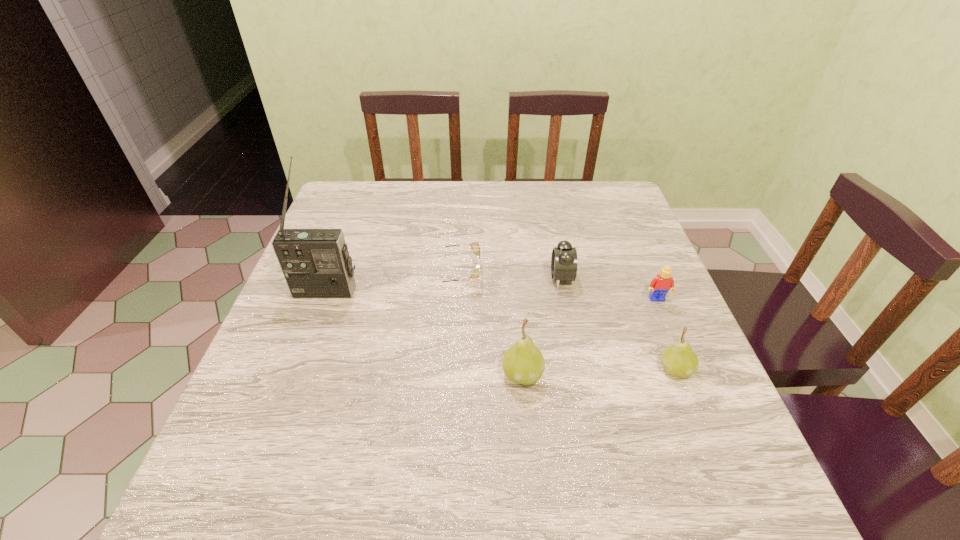
Identify the location of vacant point located 0.100m on the left of the right pear. (610, 369).

This screenshot has width=960, height=540. Identify the location of free space located on the front lenses of the sunglasses. (504, 274).

At what (x,y) coordinates should I click in order to perform the action: click on free space located 0.140m on the front-facing side of the Lego. Please return your answer as a coordinate pair (x, y). This screenshot has width=960, height=540. Looking at the image, I should click on pos(679,350).

Identify the location of vacant point located on the front side of the fourth object from left to right. (441, 278).

Locate an element on the screen. free location located on the front side of the fourth object from left to right is located at coordinates (453, 278).

What are the coordinates of `vacant space located on the front side of the fourth object from left to right` in the screenshot? It's located at (530, 278).

Where is `free space located 0.090m on the display of the leftmost object`? free space located 0.090m on the display of the leftmost object is located at coordinates (312, 329).

You are a GUI agent. You are given a task and a screenshot of the screen. Output one action in this format:
    pyautogui.click(x=<x>, y=<y>)
    Task: Click on the object located in the left edge section of the desktop
    
    Given the screenshot: What is the action you would take?
    pyautogui.click(x=316, y=264)

Locate an element on the screen. The width and height of the screenshot is (960, 540). pear located in the right edge section of the desktop is located at coordinates (679, 360).

The width and height of the screenshot is (960, 540). What are the coordinates of `Lego present at the right edge` in the screenshot? It's located at (663, 282).